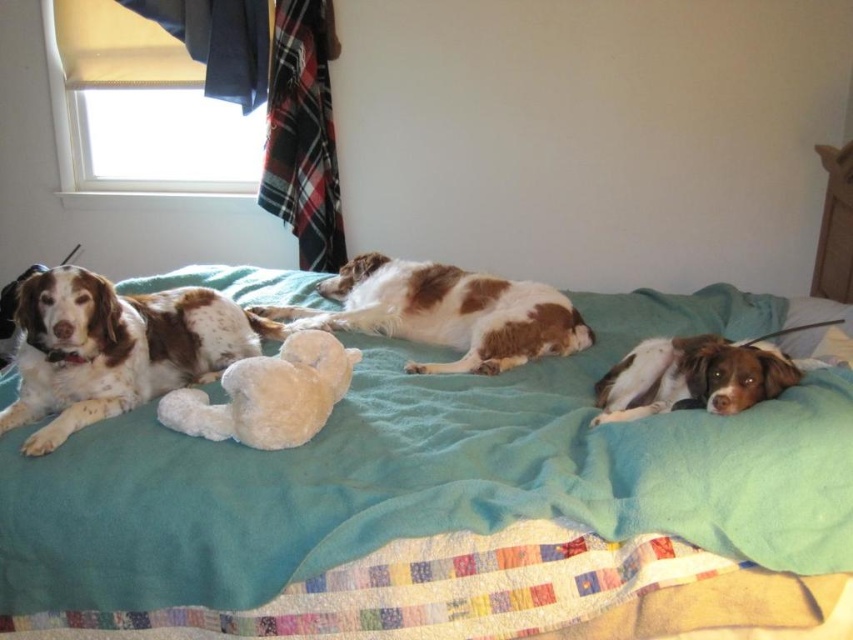
Question: Which point is farther to the camera?

Choices:
 (A) (672, 401)
 (B) (793, 340)
 (C) (317, 368)

Answer: (B)

Question: Which of the following is the closest to the observer?

Choices:
 (A) (256, 321)
 (B) (337, 344)

Answer: (B)

Question: Among these points, which one is nearest to the camera?

Choices:
 (A) (456, 282)
 (B) (660, 385)

Answer: (B)

Question: Is teal soft blanket at center bigger than speckled white fur dog at left?

Choices:
 (A) yes
 (B) no

Answer: (A)

Question: Where is white fluffy teddy bear at center located in relation to white fluffy pillow at lower right in the image?

Choices:
 (A) below
 (B) above

Answer: (A)

Question: Does brown speckled fur at center appear over white fluffy pillow at lower right?

Choices:
 (A) yes
 (B) no

Answer: (A)